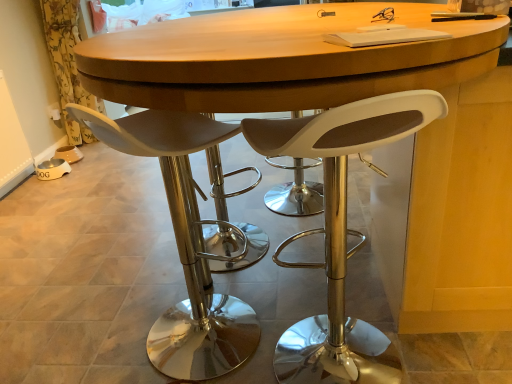
This screenshot has height=384, width=512. What are the coordinates of `free space behind white matte stool at center, which is the second chair from left to right` in the screenshot? It's located at (301, 292).